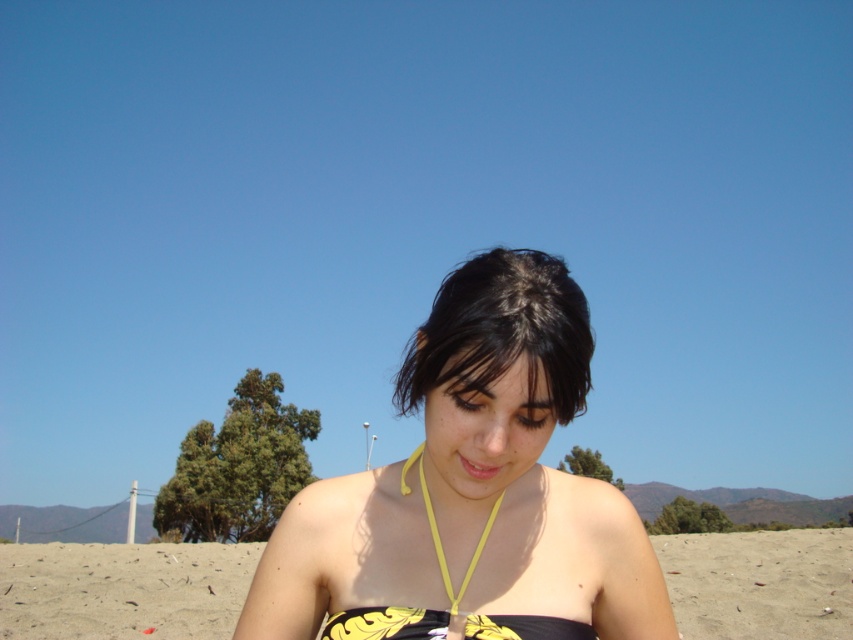
Question: Which object appears closest to the camera in this image?

Choices:
 (A) black matte swimsuit at center
 (B) yellow printed fabric bikini top at center

Answer: (A)

Question: Is black matte swimsuit at center above black/yellow fabric bikini top at center?

Choices:
 (A) yes
 (B) no

Answer: (A)

Question: Among these objects, which one is nearest to the camera?

Choices:
 (A) black matte swimsuit at center
 (B) yellow printed bikini top at center
 (C) yellow printed fabric bikini top at center

Answer: (A)

Question: Where is black/yellow fabric bikini top at center located in relation to yellow printed bikini top at center in the image?

Choices:
 (A) above
 (B) below

Answer: (B)

Question: Which is nearer to the dark brown hair at center?

Choices:
 (A) yellow printed bikini top at center
 (B) yellow fabric necklace at center
 (C) black matte swimsuit at center
 (D) black/yellow fabric bikini top at center

Answer: (C)

Question: Can you confirm if black matte swimsuit at center is smaller than black/yellow fabric bikini top at center?

Choices:
 (A) yes
 (B) no

Answer: (A)